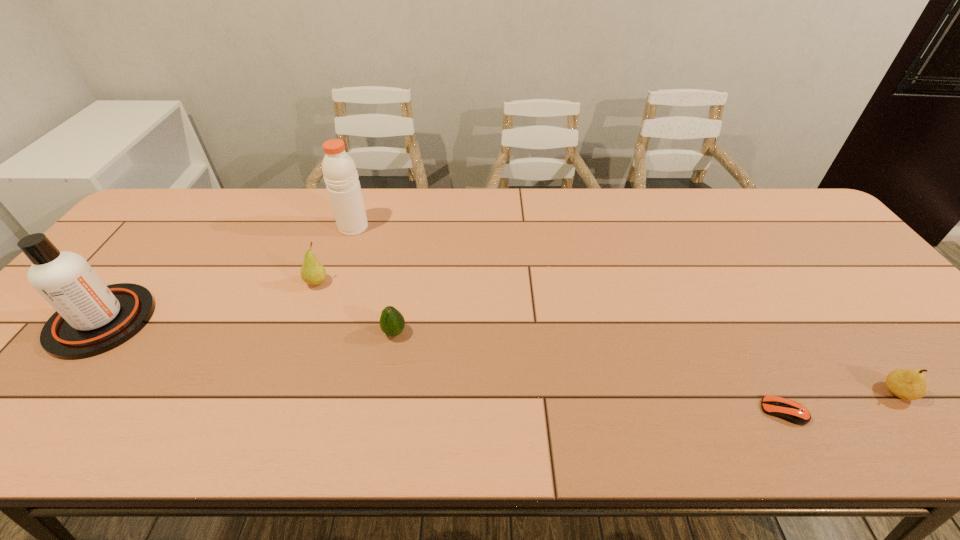
I want to click on vacant region located 0.290m on the back of the cleansing agent, so click(181, 222).

At what (x,y) coordinates should I click in order to perform the action: click on vacant space located on the back of the third tallest object. Please return your answer as a coordinate pair (x, y). Looking at the image, I should click on (346, 207).

This screenshot has height=540, width=960. Find the location of `free space located on the front of the right pear`. free space located on the front of the right pear is located at coordinates (928, 433).

Find the location of `vacant space located 0.080m on the right of the third object from right to left`. vacant space located 0.080m on the right of the third object from right to left is located at coordinates (440, 333).

Identify the location of free space located on the back of the shortest object. This screenshot has height=540, width=960. (727, 307).

At what (x,y) coordinates should I click in order to perform the action: click on object situated at the far edge. Please return your answer as a coordinate pair (x, y). The image size is (960, 540). Looking at the image, I should click on (339, 170).

I want to click on pear that is at the near edge, so click(x=906, y=384).

The image size is (960, 540). What are the coordinates of `computer mouse positioned at the near edge` in the screenshot? It's located at (788, 410).

The height and width of the screenshot is (540, 960). Find the location of `object located in the left edge section of the desktop`. object located in the left edge section of the desktop is located at coordinates (91, 318).

Image resolution: width=960 pixels, height=540 pixels. I want to click on object situated at the right edge, so click(906, 384).